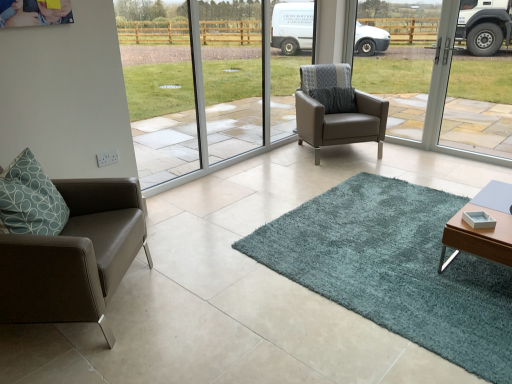
Question: Can you confirm if matte gray leather armchair at center, the second chair in the front-to-back sequence, is wider than teal shaggy rug at center?

Choices:
 (A) no
 (B) yes

Answer: (A)

Question: Is matte gray leather armchair at center, the second chair viewed from the left, in contact with teal shaggy rug at center?

Choices:
 (A) yes
 (B) no

Answer: (B)

Question: Is matte gray leather armchair at center, the 1th chair when ordered from back to front, positioned with its back to teal shaggy rug at center?

Choices:
 (A) yes
 (B) no

Answer: (B)

Question: Is matte gray leather armchair at center, which ranks as the first chair in right-to-left order, further to the viewer compared to teal shaggy rug at center?

Choices:
 (A) no
 (B) yes

Answer: (B)

Question: Considering the relative positions of matte gray leather armchair at center, the 2th chair positioned from the bottom, and teal shaggy rug at center in the image provided, is matte gray leather armchair at center, the 2th chair positioned from the bottom, to the right of teal shaggy rug at center from the viewer's perspective?

Choices:
 (A) yes
 (B) no

Answer: (B)

Question: Does matte gray leather armchair at center, which is the 1th chair in top-to-bottom order, have a lesser width compared to teal shaggy rug at center?

Choices:
 (A) no
 (B) yes

Answer: (B)

Question: Is teal shaggy rug at center positioned beyond the bounds of matte gray leather armchair at center, the 2th chair positioned from the bottom?

Choices:
 (A) no
 (B) yes

Answer: (B)

Question: Could you tell me if teal shaggy rug at center is turned towards matte gray leather armchair at center, the second chair in the front-to-back sequence?

Choices:
 (A) yes
 (B) no

Answer: (B)

Question: Considering the relative sizes of teal shaggy rug at center and matte gray leather armchair at center, the second chair viewed from the left, in the image provided, is teal shaggy rug at center shorter than matte gray leather armchair at center, the second chair viewed from the left,?

Choices:
 (A) no
 (B) yes

Answer: (B)

Question: Is teal shaggy rug at center in contact with matte gray leather armchair at center, the 2th chair positioned from the bottom?

Choices:
 (A) yes
 (B) no

Answer: (B)

Question: Does teal shaggy rug at center lie behind matte gray leather armchair at center, which ranks as the first chair in right-to-left order?

Choices:
 (A) yes
 (B) no

Answer: (B)

Question: Is teal shaggy rug at center positioned before matte gray leather armchair at center, which ranks as the first chair in right-to-left order?

Choices:
 (A) yes
 (B) no

Answer: (A)

Question: Can you confirm if matte brown leather chair at left, the 1th chair viewed from the front, is positioned to the right of matte gray leather armchair at center, which is the 1th chair in top-to-bottom order?

Choices:
 (A) yes
 (B) no

Answer: (B)